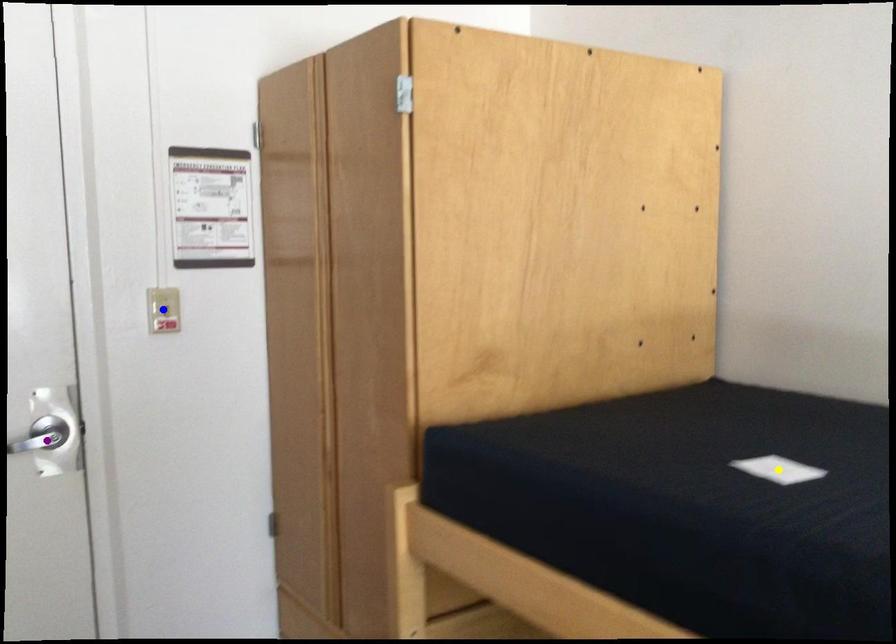
Order these from farthest to nearest:
1. blue point
2. yellow point
3. purple point

blue point
purple point
yellow point